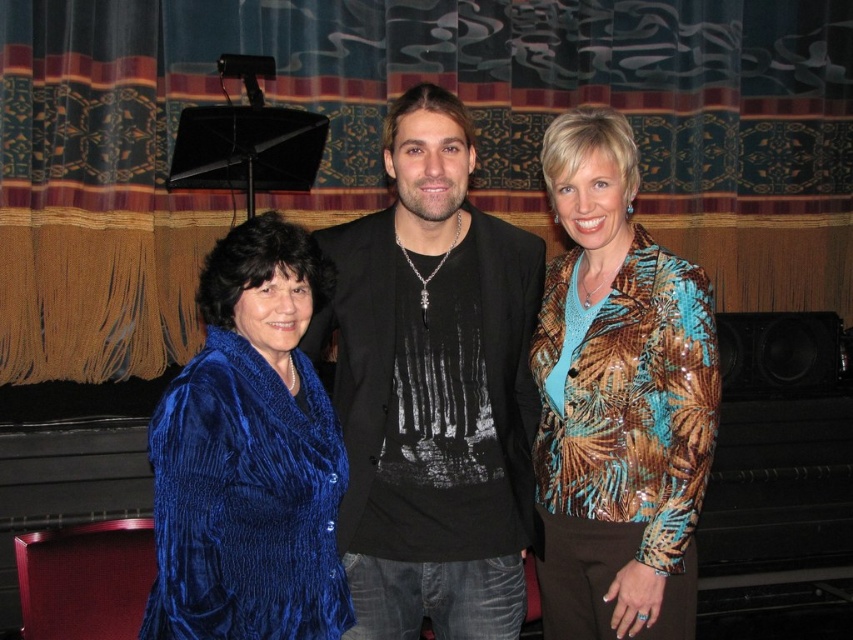
Can you confirm if velvet blue dress at left is thinner than velvet blue jacket at left?

No, velvet blue dress at left is not thinner than velvet blue jacket at left.

Which is in front, point (633, 195) or point (231, 230)?

Point (231, 230) is in front.

In order to click on velvet blue dress at left in this screenshot , I will do `click(486, 413)`.

Can you confirm if velvet blue curtain at center is positioned above velvet blue dress at left?

A: Yes.

Does point (595, 52) come in front of point (465, 276)?

No, it is not.

At what (x,y) coordinates should I click in order to perform the action: click on velvet blue curtain at center. Please return your answer as a coordinate pair (x, y). Looking at the image, I should click on (379, 141).

Who is more distant from viewer, (373, 573) or (556, 540)?

The point (556, 540) is behind.

Between point (440, 192) and point (573, 472), which one is positioned behind?

Point (573, 472)

At what (x,y) coordinates should I click in order to perform the action: click on velvet blue dress at left. Please return your answer as a coordinate pair (x, y). Looking at the image, I should click on (486, 413).